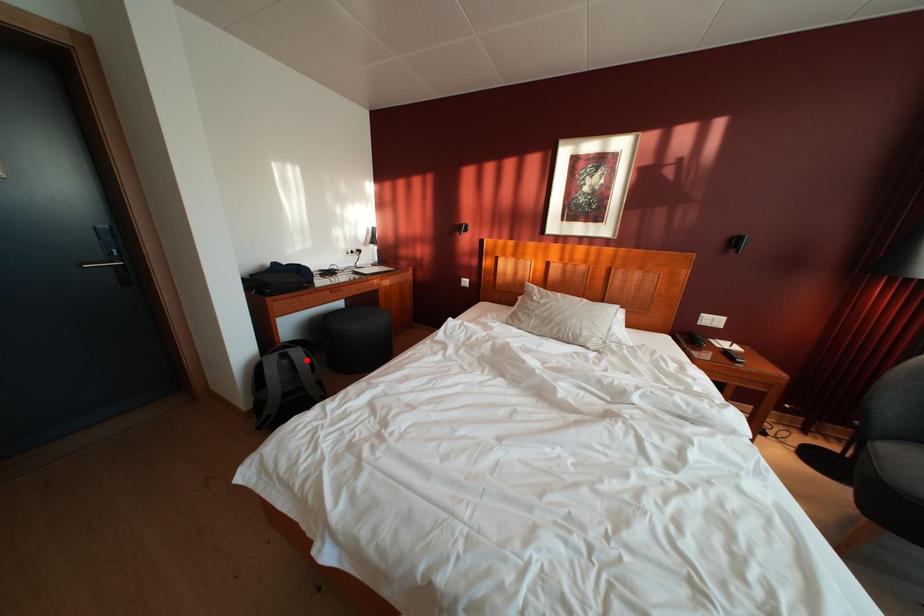
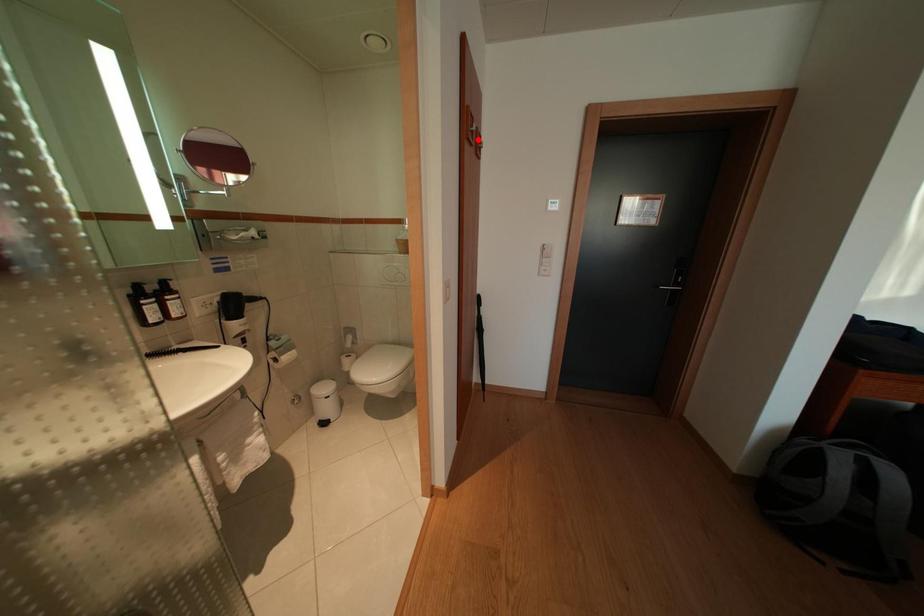
I am providing you with two images of the same scene from different viewpoints. A red point is marked on the first image and another point is marked on the second image. Is the red point in image1 aligned with the point shown in image2?

No